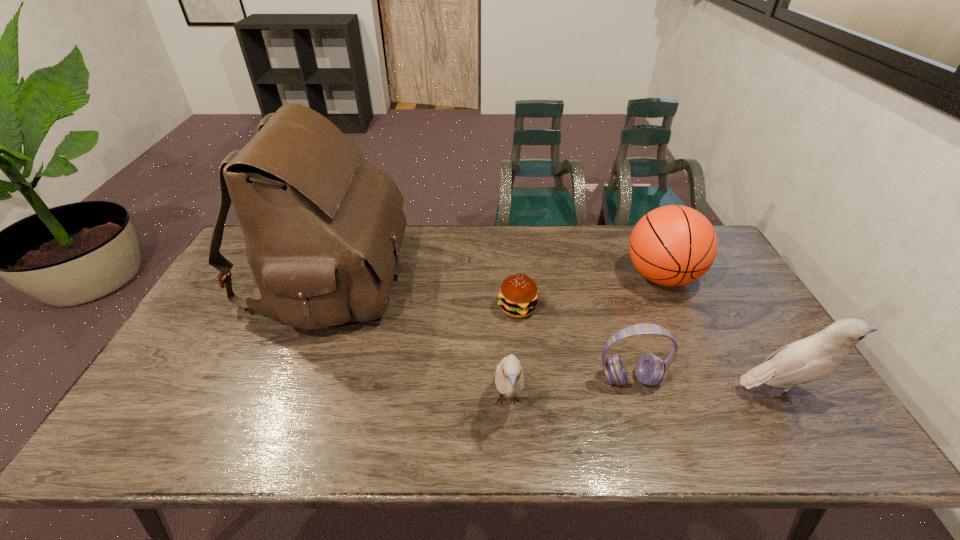
Find the location of a particular element. Image resolution: width=960 pixels, height=540 pixels. satchel located in the far edge section of the desktop is located at coordinates (323, 226).

Locate an element on the screen. basketball that is at the far edge is located at coordinates (674, 245).

Where is `headset present at the near edge`? The image size is (960, 540). headset present at the near edge is located at coordinates (650, 369).

At what (x,y) coordinates should I click in order to perform the action: click on object that is at the left edge. Please return your answer as a coordinate pair (x, y). The width and height of the screenshot is (960, 540). Looking at the image, I should click on (323, 226).

I want to click on bird that is at the right edge, so click(x=814, y=357).

Identify the location of basketball present at the right edge. The width and height of the screenshot is (960, 540). (674, 245).

Where is `object located at the far left corner`? object located at the far left corner is located at coordinates (323, 226).

The width and height of the screenshot is (960, 540). In order to click on object that is positioned at the far right corner in this screenshot , I will do `click(674, 245)`.

Where is `object that is at the near right corner`? Image resolution: width=960 pixels, height=540 pixels. object that is at the near right corner is located at coordinates (814, 357).

This screenshot has height=540, width=960. What are the coordinates of `vacant space at the far edge of the desktop` in the screenshot? It's located at (573, 228).